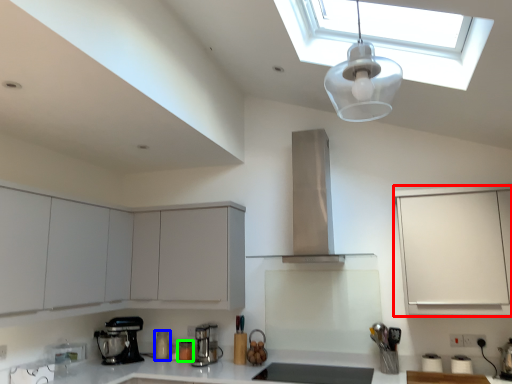
Question: Which is farther away from cabinetry (highlighted by a red box)? kitchen appliance (highlighted by a blue box) or kitchen appliance (highlighted by a green box)?

Choices:
 (A) kitchen appliance
 (B) kitchen appliance

Answer: (A)